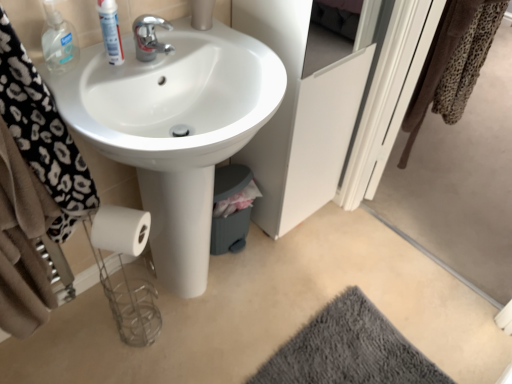
Question: Relative to white glossy sink at center, is black leopard print towel at left in front or behind?

Choices:
 (A) front
 (B) behind

Answer: (A)

Question: Considering the positions of black leopard print towel at left and white glossy sink at center in the image, is black leopard print towel at left wider or thinner than white glossy sink at center?

Choices:
 (A) thin
 (B) wide

Answer: (A)

Question: Which of these objects is positioned farthest from the gray fuzzy rug at lower right?

Choices:
 (A) leopard print towel at upper right
 (B) white glossy sink at center
 (C) white matte cabinet at center, which is the second screen door in right-to-left order
 (D) chrome metallic faucet at upper center
 (E) white glossy mouthwash at upper left, arranged as the 1th mouthwash when viewed from the right

Answer: (E)

Question: Considering the real-world distances, which object is closest to the white glossy mouthwash at upper left, which ranks as the second mouthwash in left-to-right order?

Choices:
 (A) chrome metallic faucet at upper center
 (B) white matte cabinet at center, which is counted as the 1th screen door, starting from the left
 (C) transparent plastic screen door at upper right, arranged as the first screen door when viewed from the right
 (D) white glossy sink at center
 (E) clear plastic bottle at upper left, positioned as the first mouthwash in left-to-right order

Answer: (A)